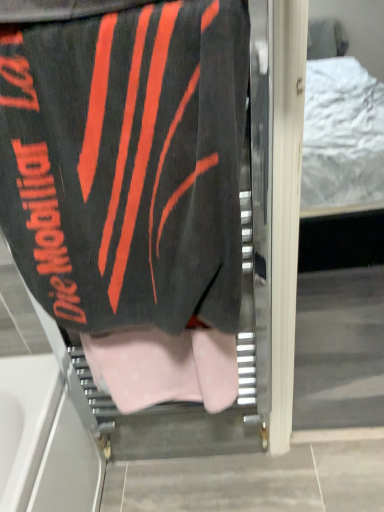
Question: Does pink polka dot fabric at center have a greater width compared to black fabric towel at upper left?

Choices:
 (A) no
 (B) yes

Answer: (A)

Question: Would you say pink polka dot fabric at center is a long distance from black fabric towel at upper left?

Choices:
 (A) yes
 (B) no

Answer: (B)

Question: Does pink polka dot fabric at center have a larger size compared to black fabric towel at upper left?

Choices:
 (A) no
 (B) yes

Answer: (A)

Question: Is pink polka dot fabric at center completely or partially outside of black fabric towel at upper left?

Choices:
 (A) no
 (B) yes

Answer: (B)

Question: From the image's perspective, is pink polka dot fabric at center located beneath black fabric towel at upper left?

Choices:
 (A) yes
 (B) no

Answer: (A)

Question: Is pink polka dot fabric at center thinner than black fabric towel at upper left?

Choices:
 (A) yes
 (B) no

Answer: (A)

Question: Could you tell me if black fabric towel at upper left is facing pink polka dot fabric at center?

Choices:
 (A) no
 (B) yes

Answer: (A)

Question: Considering the relative sizes of black fabric towel at upper left and pink polka dot fabric at center in the image provided, is black fabric towel at upper left bigger than pink polka dot fabric at center?

Choices:
 (A) no
 (B) yes

Answer: (B)

Question: Can we say black fabric towel at upper left lies outside pink polka dot fabric at center?

Choices:
 (A) yes
 (B) no

Answer: (A)

Question: From a real-world perspective, is black fabric towel at upper left under pink polka dot fabric at center?

Choices:
 (A) yes
 (B) no

Answer: (B)

Question: Is black fabric towel at upper left not near pink polka dot fabric at center?

Choices:
 (A) yes
 (B) no

Answer: (B)

Question: Does black fabric towel at upper left have a lesser height compared to pink polka dot fabric at center?

Choices:
 (A) no
 (B) yes

Answer: (A)

Question: From the image's perspective, relative to pink polka dot fabric at center, is black fabric towel at upper left above or below?

Choices:
 (A) above
 (B) below

Answer: (A)